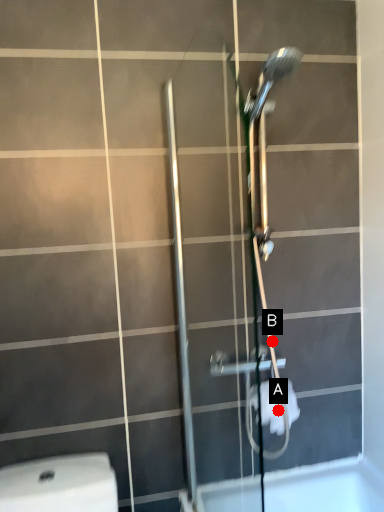
Question: Two points are circled on the image, labeled by A and B beside each circle. Which point appears farthest from the camera in this image?

Choices:
 (A) A is further
 (B) B is further

Answer: (B)